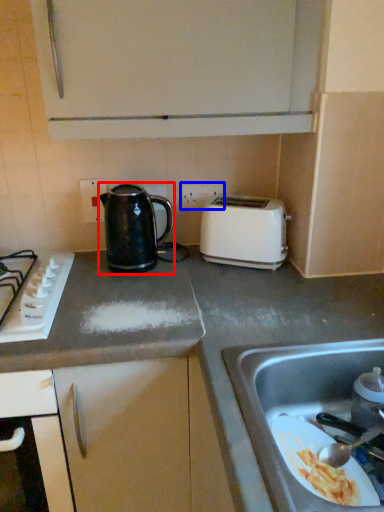
Question: Which point is closer to the camera, kettle (highlighted by a red box) or electric outlet (highlighted by a blue box)?

Choices:
 (A) kettle
 (B) electric outlet

Answer: (A)